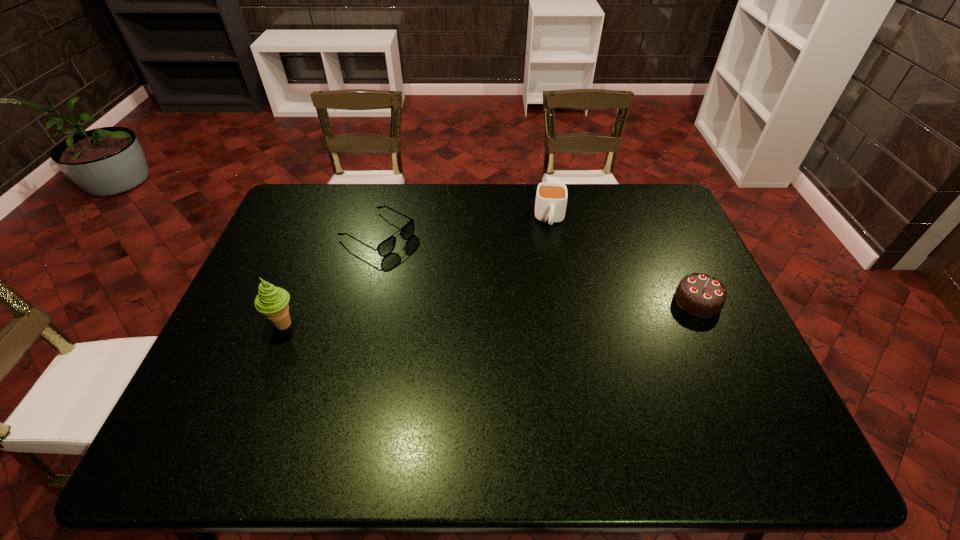
This screenshot has width=960, height=540. What are the coordinates of `free space on the desktop that is between the leftmost object and the chocolate cake and is positioned on the side with the handle of the cup` in the screenshot? It's located at (553, 309).

At what (x,y) coordinates should I click in order to perform the action: click on free space on the desktop that is between the leftmost object and the chocolate cake and is positioned on the front-facing side of the third object from right to left. Please return your answer as a coordinate pair (x, y). Looking at the image, I should click on (519, 311).